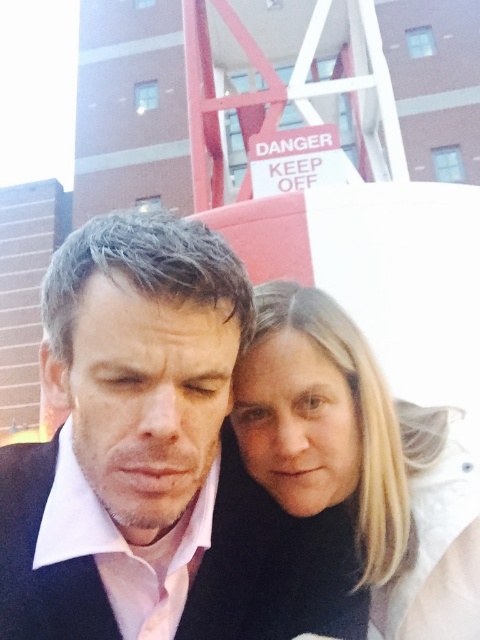
Question: Among these points, which one is farthest from the camera?

Choices:
 (A) (420, 524)
 (B) (196, 484)

Answer: (A)

Question: Which of the following is the closest to the observer?

Choices:
 (A) (285, 419)
 (B) (228, 568)

Answer: (B)

Question: Is blonde hair at center positioned before black matte suit at center?

Choices:
 (A) yes
 (B) no

Answer: (B)

Question: Is pink satin shirt at center thinner than blonde hair at center?

Choices:
 (A) yes
 (B) no

Answer: (B)

Question: Is blonde hair at center above black matte suit at center?

Choices:
 (A) no
 (B) yes

Answer: (B)

Question: Which of the following is the farthest from the observer?

Choices:
 (A) blonde hair at center
 (B) pink satin shirt at center

Answer: (A)